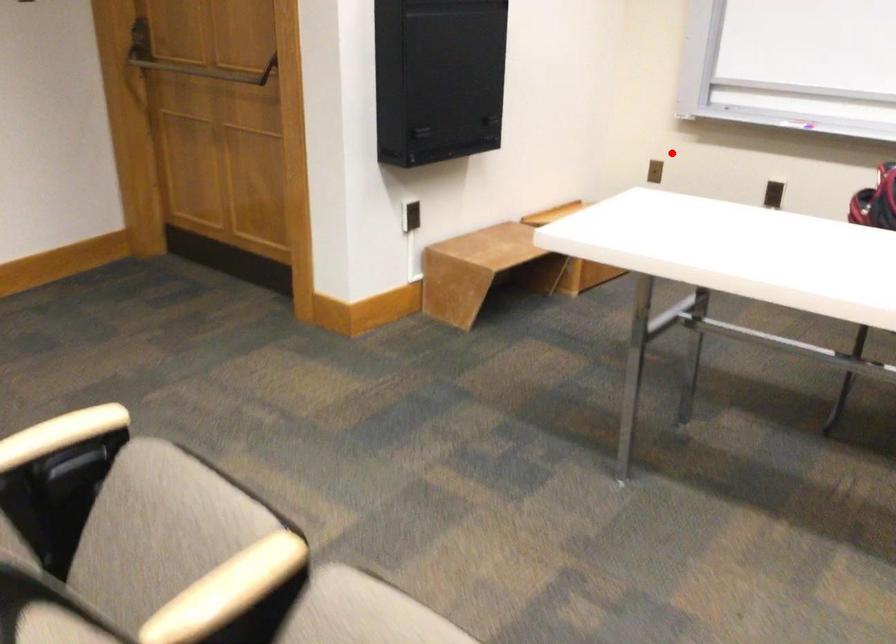
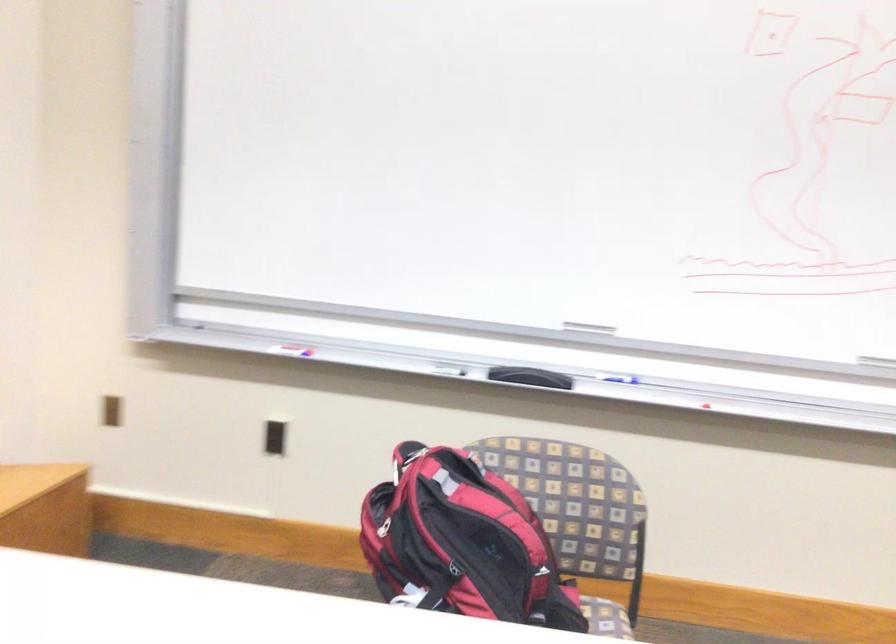
Question: I am providing you with two images of the same scene from different viewpoints. A red point is shown in image1. For the corresponding object point in image2, is it positioned nearer or farther from the camera?

Choices:
 (A) Nearer
 (B) Farther

Answer: (A)